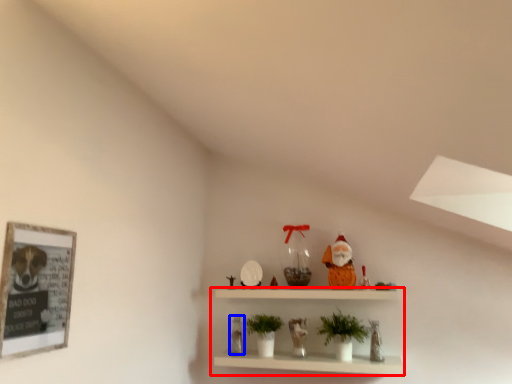
Question: Among these objects, which one is nearest to the camera, shelf (highlighted by a red box) or toy (highlighted by a blue box)?

Choices:
 (A) shelf
 (B) toy

Answer: (A)